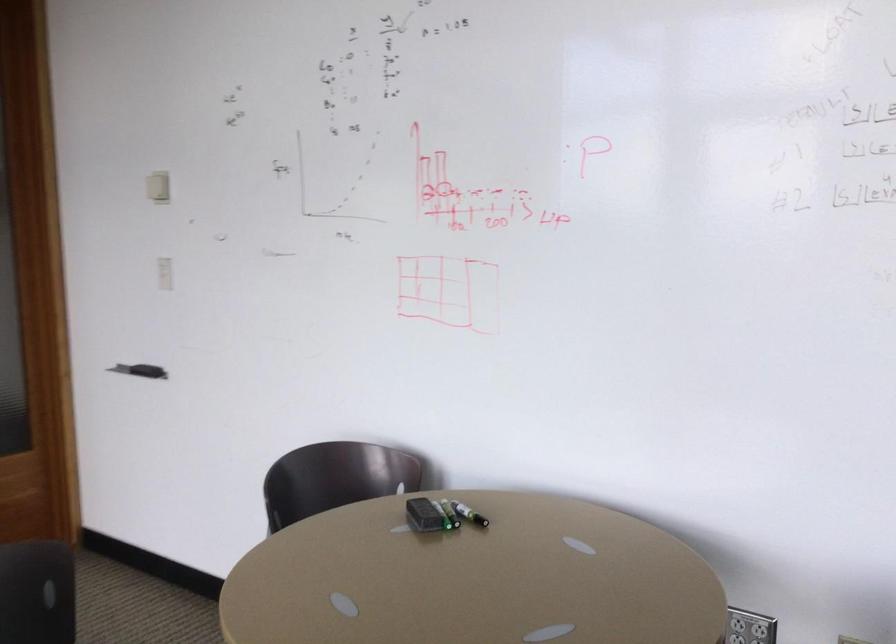
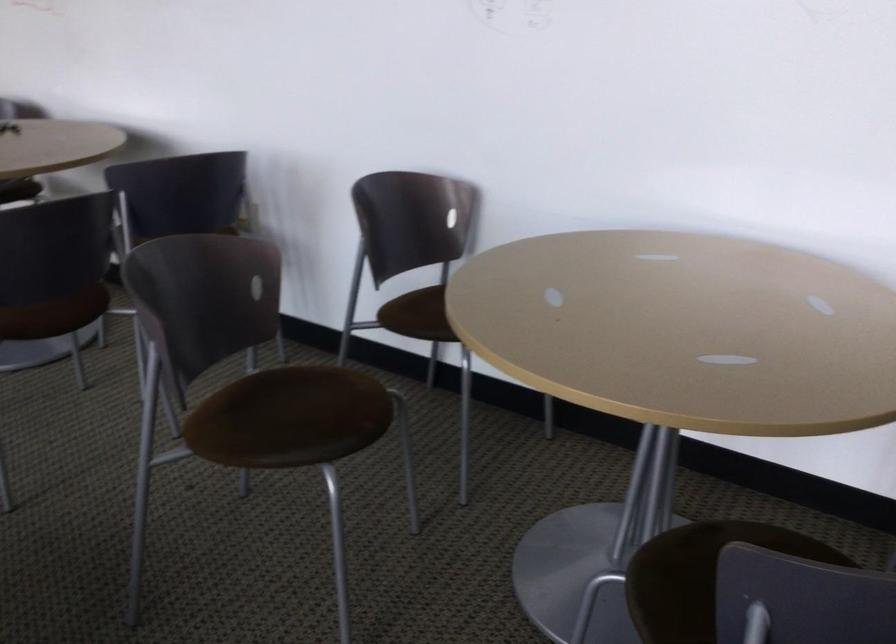
The images are taken continuously from a first-person perspective. In which direction are you moving?

The movement direction of the cameraman is right, backward.